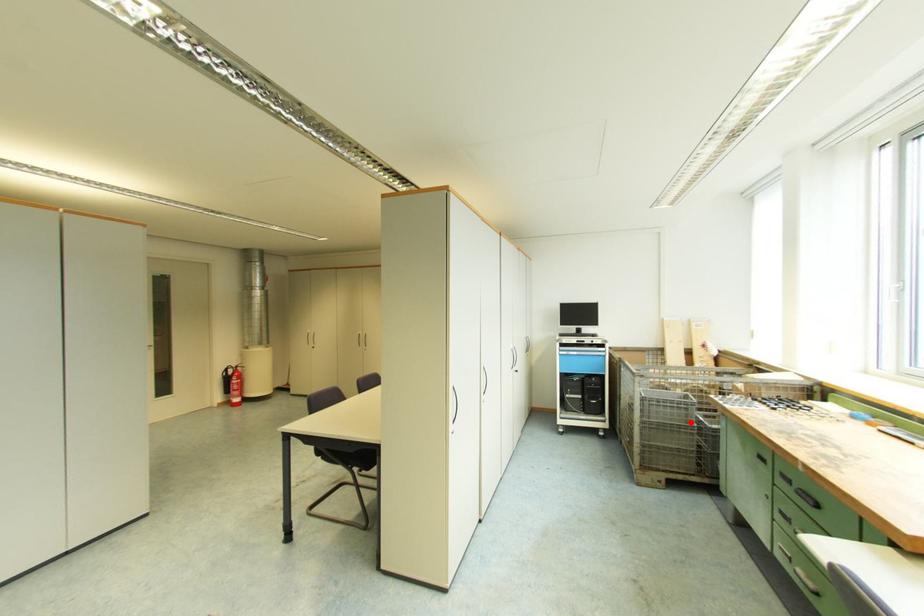
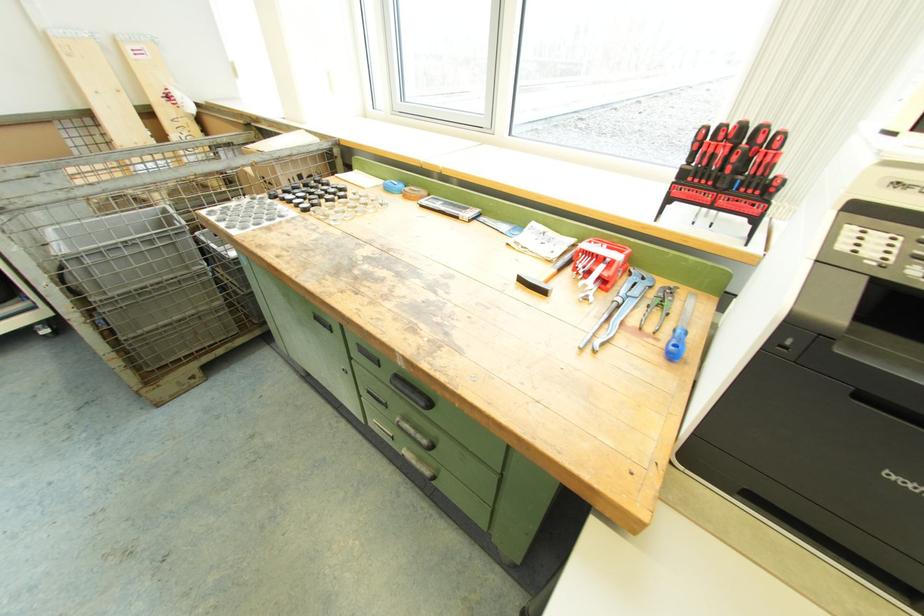
In the second image, find the point that corresponds to the highlighted location in the first image.

(190, 268)